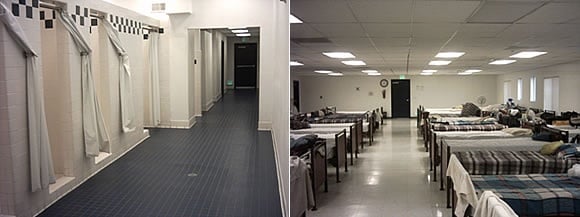
This screenshot has width=580, height=217. I want to click on floor, so click(250, 110).